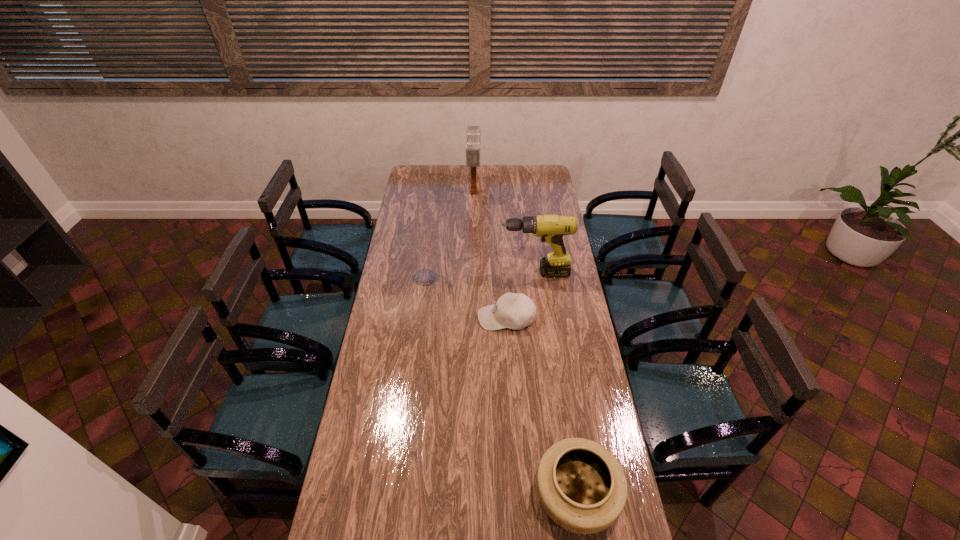
The height and width of the screenshot is (540, 960). Find the location of `the farthest object`. the farthest object is located at coordinates (473, 132).

What are the coordinates of `drill` in the screenshot? It's located at (551, 228).

I want to click on flute glass, so click(420, 241).

Identify the location of the third shortest object. The height and width of the screenshot is (540, 960). (420, 241).

Locate an element on the screen. This screenshot has width=960, height=540. the shortest object is located at coordinates (515, 311).

You are a GUI agent. You are given a task and a screenshot of the screen. Output one action in this format:
    pyautogui.click(x=<x>, y=<y>)
    Task: Click on the second nearest object
    The image size is (960, 540).
    Given the screenshot: What is the action you would take?
    pyautogui.click(x=515, y=311)

Where is `free spot located on the front of the mallet`? free spot located on the front of the mallet is located at coordinates (473, 225).

Where is `vacant position located on the handle side of the drill`? vacant position located on the handle side of the drill is located at coordinates (481, 273).

You are a GUI agent. You are given a task and a screenshot of the screen. Output one action in this format:
    pyautogui.click(x=<x>, y=<y>)
    Task: Click on the vacant space located 0.060m on the handle side of the drill
    This screenshot has height=540, width=960.
    Given the screenshot: What is the action you would take?
    pyautogui.click(x=487, y=273)

The image size is (960, 540). Find the location of `free location located on the handle side of the drill`. free location located on the handle side of the drill is located at coordinates (470, 273).